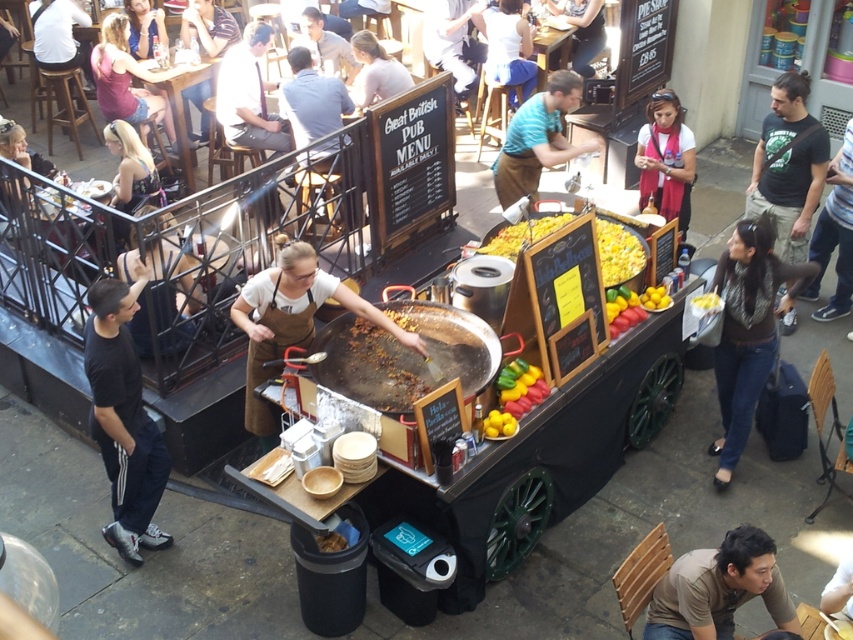
Question: Is teal fabric apron at center to the right of white scarf at center from the viewer's perspective?

Choices:
 (A) no
 (B) yes

Answer: (A)

Question: Which of the following is the closest to the observer?

Choices:
 (A) brown cotton shirt at lower right
 (B) teal fabric apron at center

Answer: (A)

Question: Is brown cotton shirt at lower right wider than yellow glossy lemon at center?

Choices:
 (A) yes
 (B) no

Answer: (A)

Question: Which point appears farthest from the camera in this image?

Choices:
 (A) (721, 612)
 (B) (508, 177)
 (C) (679, 227)

Answer: (C)

Question: Does light brown tie at center appear over white scarf at center?

Choices:
 (A) no
 (B) yes

Answer: (B)

Question: Which point appears farthest from the camera in this image?

Choices:
 (A) (126, 520)
 (B) (335, 33)
 (C) (779, 180)

Answer: (B)